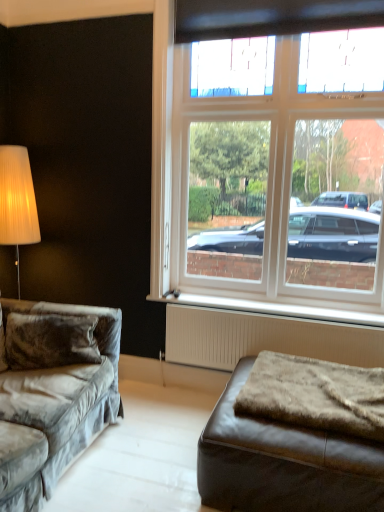
Question: Is brown leather ottoman at lower right to the left or to the right of velvet gray couch at left in the image?

Choices:
 (A) right
 (B) left

Answer: (A)

Question: From a real-world perspective, is brown leather ottoman at lower right physically located above or below velvet gray couch at left?

Choices:
 (A) above
 (B) below

Answer: (B)

Question: Which of these objects is positioned farthest from the fuzzy brown blanket at lower right?

Choices:
 (A) white plastic radiator at lower center
 (B) white textured radiator at lower center
 (C) white glass window at center
 (D) velvet gray couch at left
 (E) brown leather ottoman at lower right

Answer: (C)

Question: Which object is the closest to the fuzzy brown blanket at lower right?

Choices:
 (A) white plastic radiator at lower center
 (B) white textured radiator at lower center
 (C) velvet gray couch at left
 (D) brown leather ottoman at lower right
 (E) white glass window at center

Answer: (D)